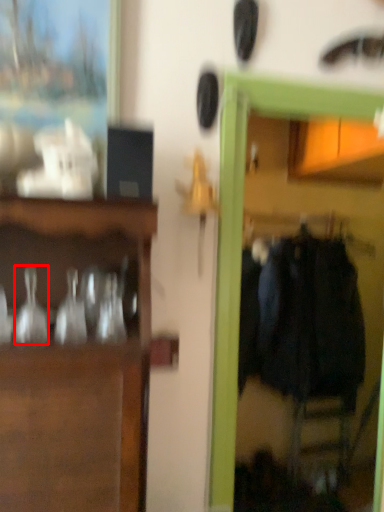
Question: From the image's perspective, considering the relative positions of glass vase (annotated by the red box) and clothing in the image provided, where is glass vase (annotated by the red box) located with respect to the staircase?

Choices:
 (A) above
 (B) below

Answer: (A)